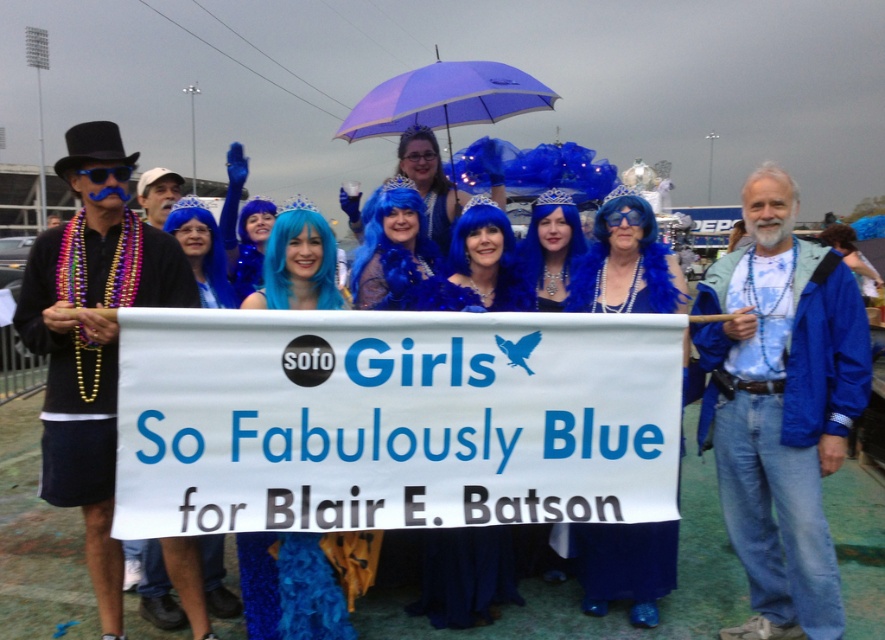
Question: Is blue denim jacket at lower right closer to camera compared to purple fabric umbrella at upper center?

Choices:
 (A) no
 (B) yes

Answer: (B)

Question: Which point is farther to the camera?

Choices:
 (A) (496, 99)
 (B) (77, 138)
 (C) (785, 352)

Answer: (A)

Question: Does matte black jacket at left have a larger size compared to purple fabric umbrella at upper center?

Choices:
 (A) yes
 (B) no

Answer: (A)

Question: Is blue denim jacket at lower right to the left of fuzzy blue boa at center from the viewer's perspective?

Choices:
 (A) yes
 (B) no

Answer: (B)

Question: Among these objects, which one is farthest from the camera?

Choices:
 (A) matte black jacket at left
 (B) blue denim jacket at lower right
 (C) fuzzy blue boa at center
 (D) purple fabric umbrella at upper center

Answer: (D)

Question: Which point is farther from the camera taking this photo?

Choices:
 (A) (99, 339)
 (B) (485, 67)
 (C) (830, 282)
 (D) (602, 566)

Answer: (B)